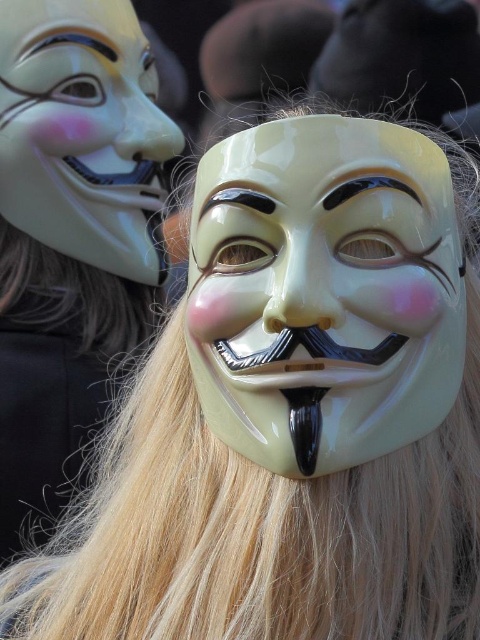
You are a photographer trying to focus on the glossy plastic mask at center in the image. The camera is set to focus at point coordinates (324, 291). Will the mask be in focus?

The glossy plastic mask at center is represented by point (324, 291), so yes, the mask will be in focus as the camera is focused on that point.

You are a photographer trying to capture both the glossy plastic mask at center and the matte white mask at upper center in a single frame. Based on their positions, which mask should you adjust your camera focus to first to ensure both are in the frame?

Since the glossy plastic mask at center is to the right of the matte white mask at upper center, you should focus on the matte white mask at upper center first as it is positioned higher up, allowing you to adjust your frame to include both masks from their relative positions.